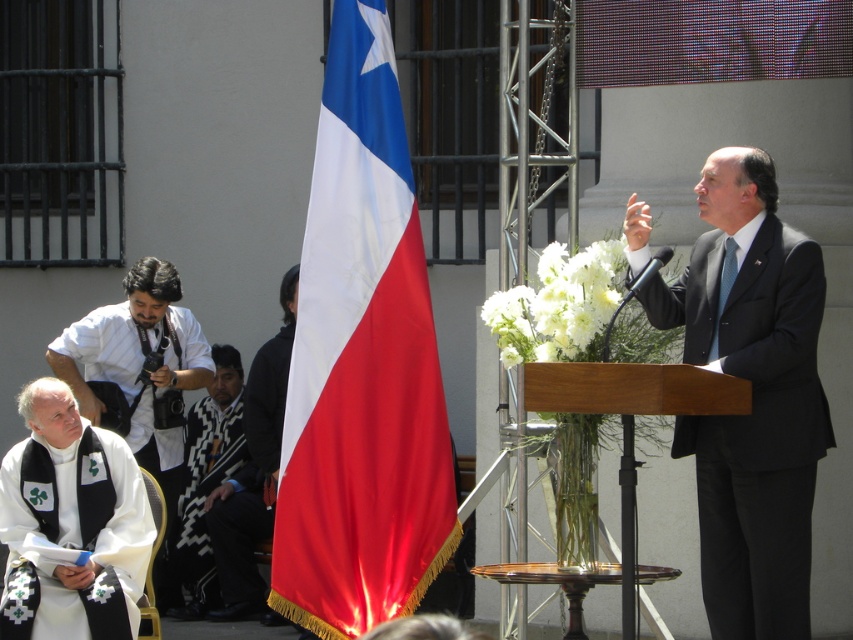
Based on the photo, is the position of matte black robe at right more distant than that of black woven robe at lower left?

No, matte black robe at right is closer to the viewer.

Between point (764, 394) and point (227, 532), which one is positioned in front?

Point (764, 394) is more forward.

You are a GUI agent. You are given a task and a screenshot of the screen. Output one action in this format:
    pyautogui.click(x=<x>, y=<y>)
    Task: Click on the matte black robe at right
    The width and height of the screenshot is (853, 640).
    Given the screenshot: What is the action you would take?
    pyautogui.click(x=753, y=422)

Is matte black robe at right in front of white matte robe at lower left?

Yes, matte black robe at right is in front of white matte robe at lower left.

Identify the location of matte black robe at right. (753, 422).

The image size is (853, 640). In order to click on matte black robe at right in this screenshot , I will do `click(753, 422)`.

Who is lower down, white matte robe at lower left or black woven robe at lower left?

white matte robe at lower left

Which is in front, point (3, 602) or point (263, 502)?

Point (3, 602) is in front.

Is point (152, 538) closer to viewer compared to point (250, 518)?

Yes, point (152, 538) is closer to viewer.

Find the location of a particular element. white matte robe at lower left is located at coordinates (73, 536).